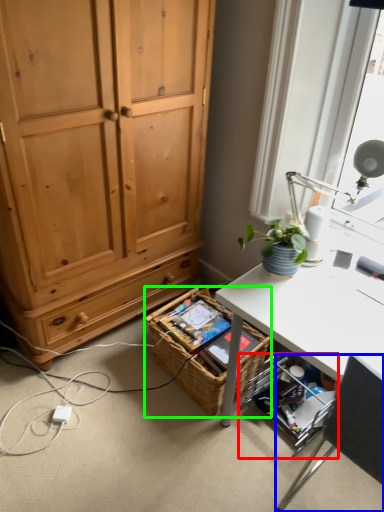
Question: Based on their relative distances, which object is farther from shelf (highlighted by a red box)? Choose from chair (highlighted by a blue box) and picnic basket (highlighted by a green box).

Choices:
 (A) chair
 (B) picnic basket

Answer: (A)